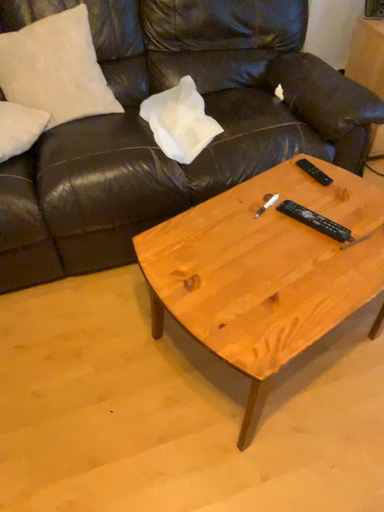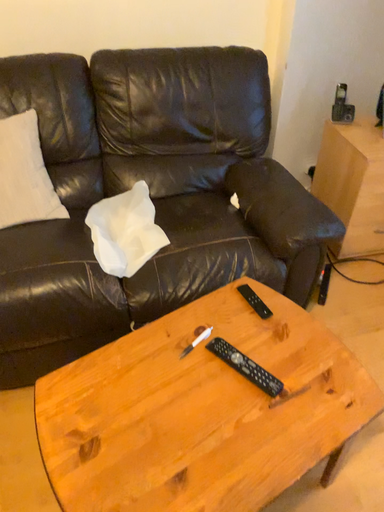
Question: How did the camera likely rotate when shooting the video?

Choices:
 (A) rotated upward
 (B) rotated downward

Answer: (A)